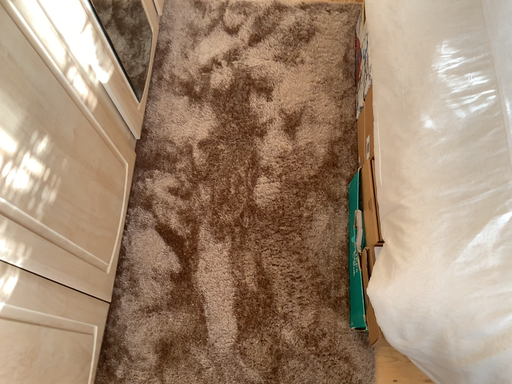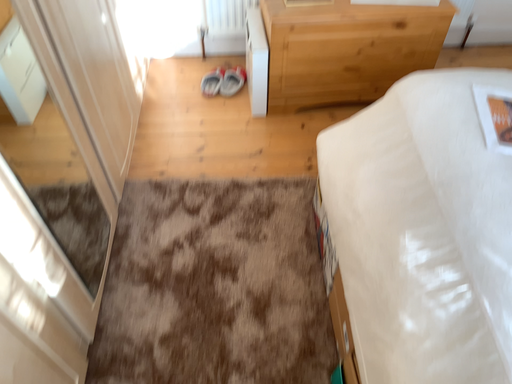
Question: Which way did the camera rotate in the video?

Choices:
 (A) rotated downward
 (B) rotated upward

Answer: (B)